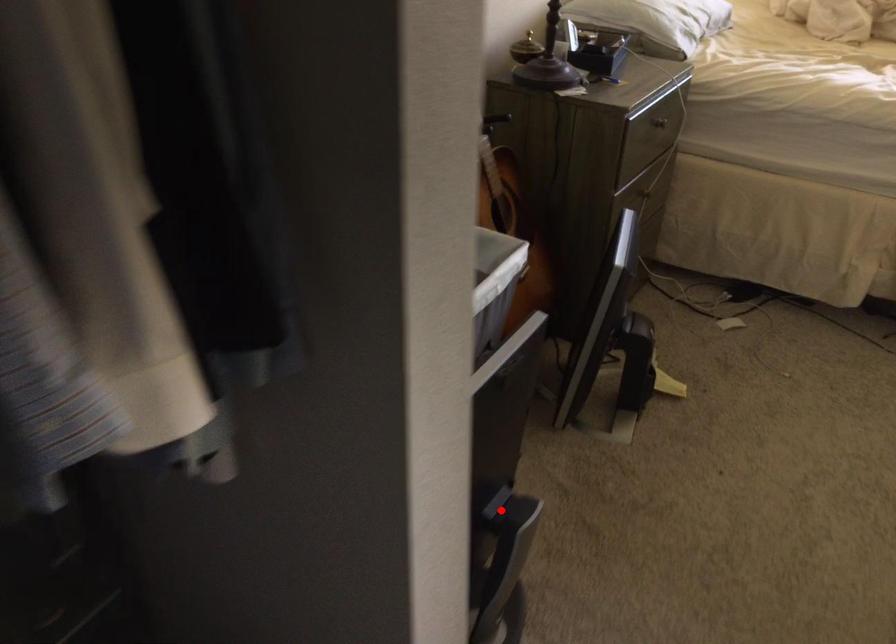
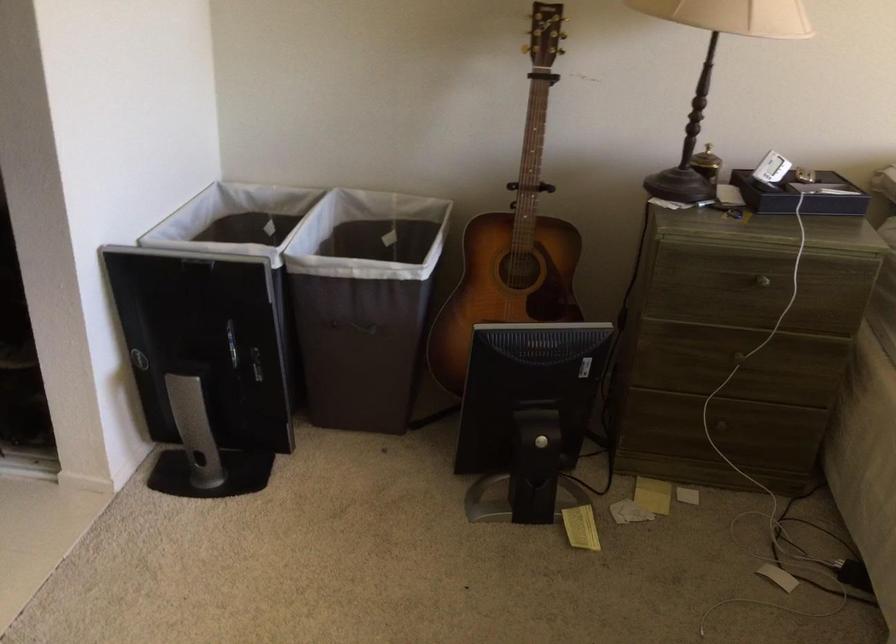
Question: I am providing you with two images of the same scene from different viewpoints. Given a red point in image1, look at the same physical point in image2. Is it:

Choices:
 (A) Closer to the viewpoint
 (B) Farther from the viewpoint

Answer: (B)